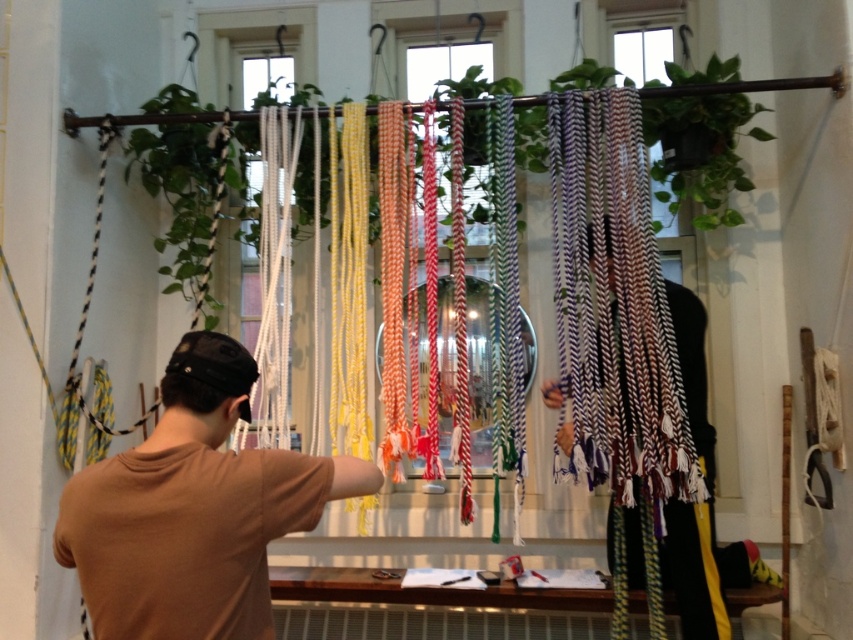
Question: Is the position of brown cotton t-shirt at center more distant than that of multicolored woven rope at center?

Choices:
 (A) yes
 (B) no

Answer: (B)

Question: Which object appears closest to the camera in this image?

Choices:
 (A) brown cotton t-shirt at center
 (B) multicolored woven rope at center

Answer: (A)

Question: Which point is closer to the camera?

Choices:
 (A) brown cotton t-shirt at center
 (B) multicolored woven rope at center

Answer: (A)

Question: Observing the image, what is the correct spatial positioning of brown cotton t-shirt at center in reference to multicolored woven rope at center?

Choices:
 (A) above
 (B) below

Answer: (A)

Question: Which point is closer to the camera?

Choices:
 (A) (212, 337)
 (B) (704, 524)

Answer: (A)

Question: Is brown cotton t-shirt at center to the right of multicolored woven rope at center from the viewer's perspective?

Choices:
 (A) yes
 (B) no

Answer: (B)